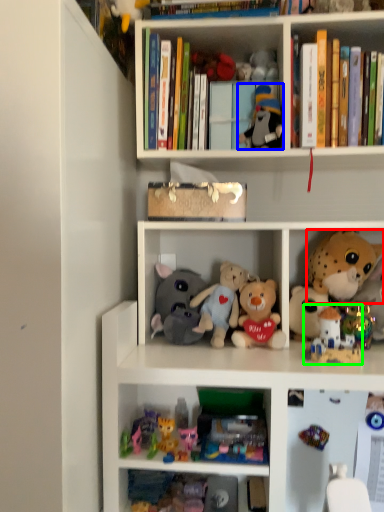
Question: Which is farther away from toy (highlighted by a red box)? toy (highlighted by a blue box) or toy (highlighted by a green box)?

Choices:
 (A) toy
 (B) toy

Answer: (A)